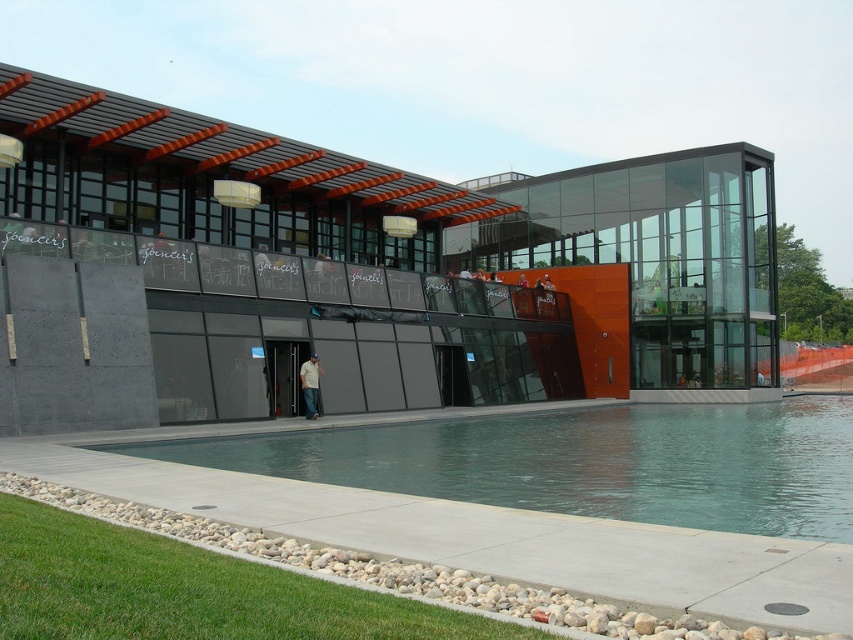
Question: Can you confirm if green concrete pool at lower center is bigger than denim jeans at center?

Choices:
 (A) yes
 (B) no

Answer: (A)

Question: Which point is closer to the camera?

Choices:
 (A) (434, 464)
 (B) (311, 364)

Answer: (A)

Question: Which of the following is the farthest from the observer?

Choices:
 (A) (312, 403)
 (B) (598, 490)

Answer: (A)

Question: Is green concrete pool at lower center closer to camera compared to denim jeans at center?

Choices:
 (A) yes
 (B) no

Answer: (A)

Question: Is green concrete pool at lower center wider than denim jeans at center?

Choices:
 (A) no
 (B) yes

Answer: (B)